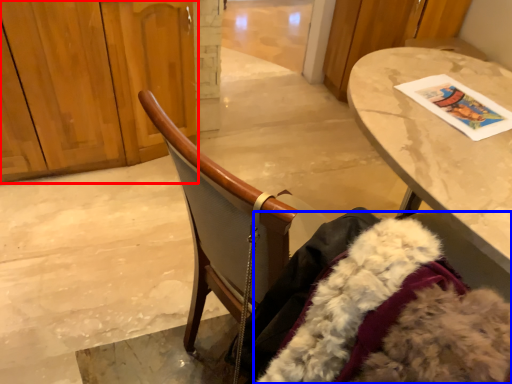
Question: Which of the following is the farthest to the observer, dresser (highlighted by a red box) or fur coat (highlighted by a blue box)?

Choices:
 (A) dresser
 (B) fur coat

Answer: (A)